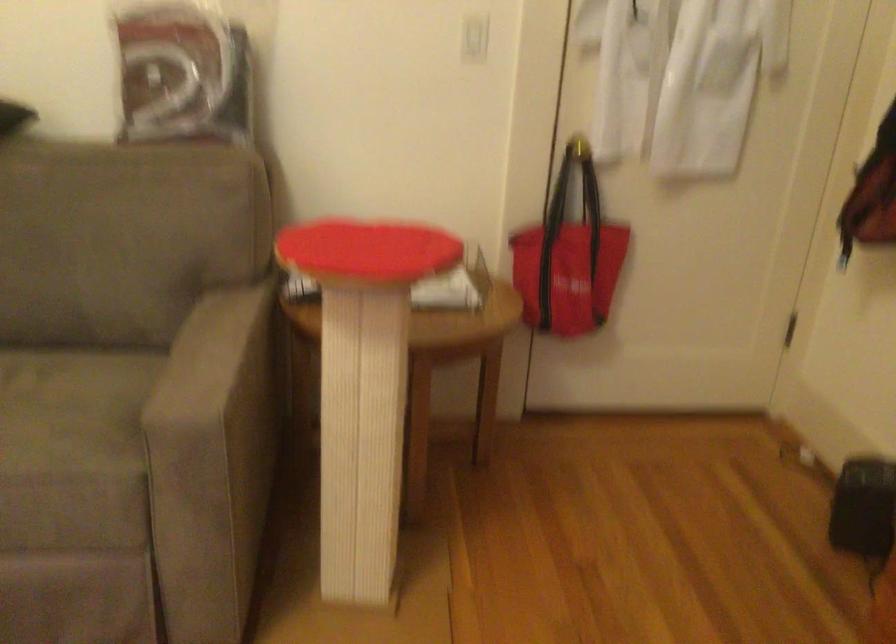
You are a GUI agent. You are given a task and a screenshot of the screen. Output one action in this format:
    pyautogui.click(x=<x>, y=<y>)
    Task: Click on the sofa armrest
    The image size is (896, 644).
    Given the screenshot: What is the action you would take?
    pyautogui.click(x=212, y=360)